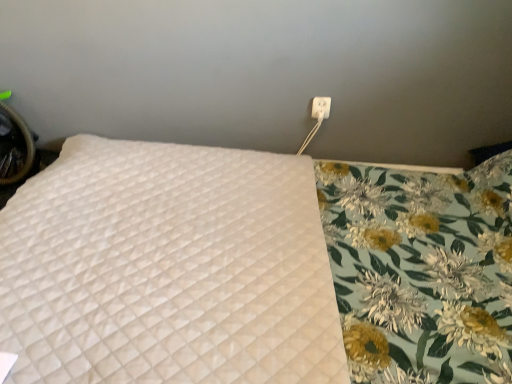
Question: Based on their positions, is white plastic outlet at upper right located to the left or right of white quilted mattress at upper left?

Choices:
 (A) left
 (B) right

Answer: (B)

Question: In the image, is white plastic outlet at upper right positioned in front of or behind white quilted mattress at upper left?

Choices:
 (A) behind
 (B) front

Answer: (A)

Question: In terms of height, does white plastic outlet at upper right look taller or shorter compared to white quilted mattress at upper left?

Choices:
 (A) tall
 (B) short

Answer: (B)

Question: Choose the correct answer: Is white quilted mattress at upper left inside white plastic outlet at upper right or outside it?

Choices:
 (A) outside
 (B) inside

Answer: (A)

Question: Considering their positions, is white quilted mattress at upper left located in front of or behind white plastic outlet at upper right?

Choices:
 (A) behind
 (B) front

Answer: (B)

Question: Looking at their shapes, would you say white quilted mattress at upper left is wider or thinner than white plastic outlet at upper right?

Choices:
 (A) wide
 (B) thin

Answer: (A)

Question: In the image, is white quilted mattress at upper left on the left side or the right side of white plastic outlet at upper right?

Choices:
 (A) right
 (B) left

Answer: (B)